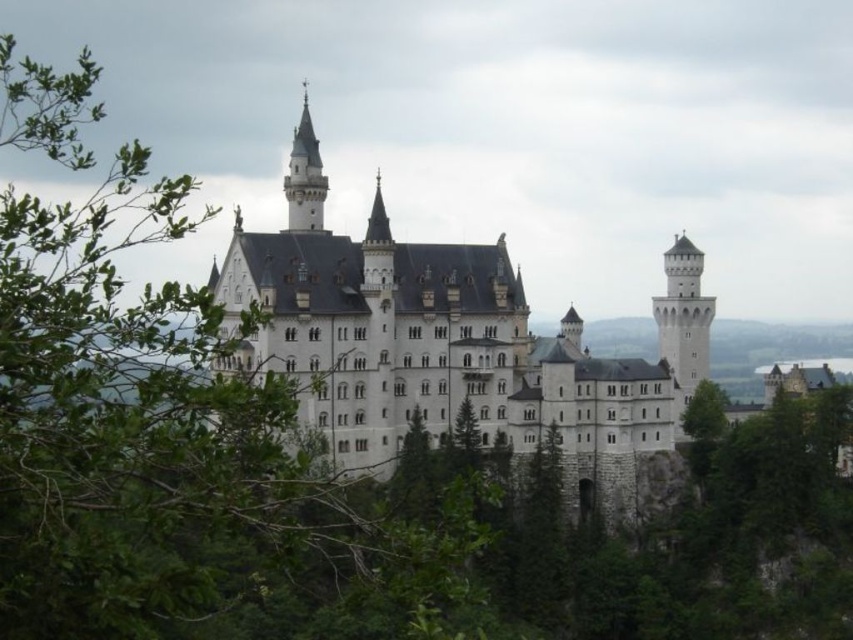
Between green leafy tree at left and white stone castle at center, which one appears on the left side from the viewer's perspective?

Positioned to the left is green leafy tree at left.

Who is lower down, green leafy tree at left or white stone castle at center?

Positioned lower is white stone castle at center.

Measure the distance between point (39, 540) and camera.

Point (39, 540) is 62.43 meters away from camera.

Locate an element on the screen. The width and height of the screenshot is (853, 640). green leafy tree at left is located at coordinates (165, 449).

Can you confirm if green leafy tree at left is shorter than white stone tower at right?

Incorrect, green leafy tree at left's height does not fall short of white stone tower at right's.

Is green leafy tree at left above white stone tower at right?

Indeed, green leafy tree at left is positioned over white stone tower at right.

Which is in front, point (230, 458) or point (695, 300)?

Positioned in front is point (230, 458).

You are a GUI agent. You are given a task and a screenshot of the screen. Output one action in this format:
    pyautogui.click(x=<x>, y=<y>)
    Task: Click on the green leafy tree at left
    Image resolution: width=853 pixels, height=640 pixels.
    Given the screenshot: What is the action you would take?
    pyautogui.click(x=165, y=449)

Who is more distant from viewer, (689, 323) or (306, 198)?

The point (689, 323) is more distant.

Consider the image. Can you confirm if white stone tower at right is smaller than white stone tower at upper center?

Incorrect, white stone tower at right is not smaller in size than white stone tower at upper center.

Is point (672, 371) behind point (300, 134)?

No, it is not.

I want to click on white stone tower at right, so 683,317.